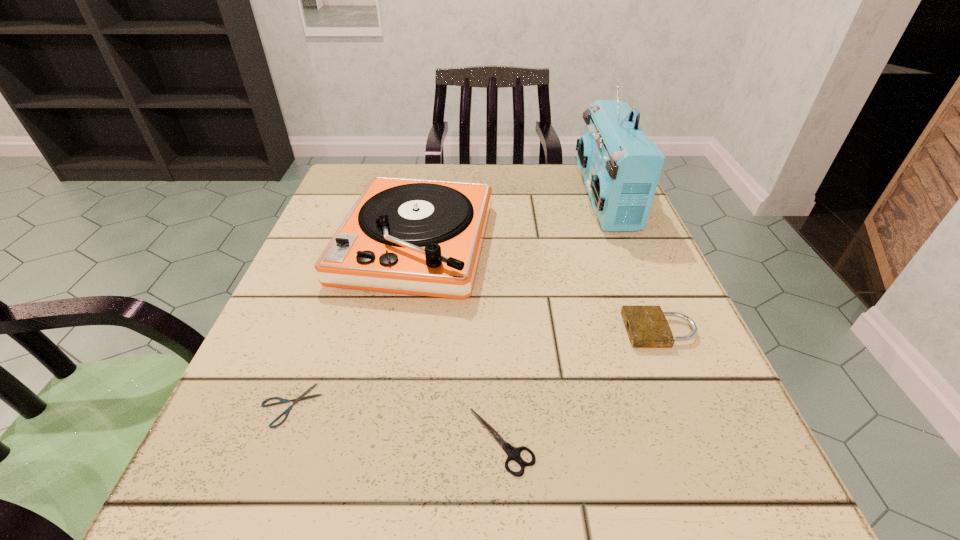
Locate an element on the screen. free point at the far left corner is located at coordinates (361, 167).

Where is `vacant point at the near right corner`? This screenshot has height=540, width=960. vacant point at the near right corner is located at coordinates (670, 508).

This screenshot has width=960, height=540. Find the location of `free spot between the third tallest object and the tallest object`. free spot between the third tallest object and the tallest object is located at coordinates (633, 265).

In order to click on vacant area that lies between the tallest object and the taller shears in this screenshot , I will do `click(553, 320)`.

The image size is (960, 540). Find the location of `free space between the second shortest object and the third shortest object`. free space between the second shortest object and the third shortest object is located at coordinates (581, 386).

Locate an element on the screen. free area in between the taller shears and the tallest object is located at coordinates (553, 320).

The height and width of the screenshot is (540, 960). Find the location of `vacant region between the shortest object and the second tallest object`. vacant region between the shortest object and the second tallest object is located at coordinates (353, 324).

This screenshot has height=540, width=960. I want to click on free space between the shortest object and the third tallest object, so click(475, 368).

Identify the location of blank region between the shortest object and the third shortest object. (475, 368).

Identify the location of empty space between the third shortest object and the second tallest object. (538, 287).